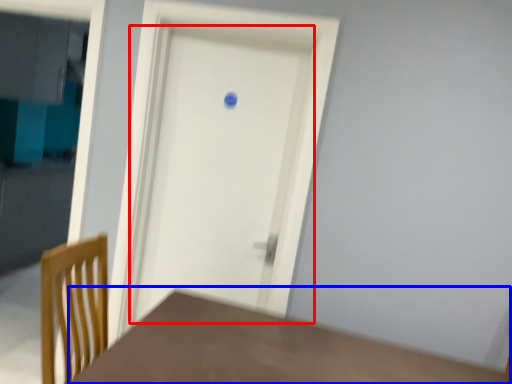
Question: Which point is further to the camera, door (highlighted by a red box) or table (highlighted by a blue box)?

Choices:
 (A) door
 (B) table

Answer: (A)